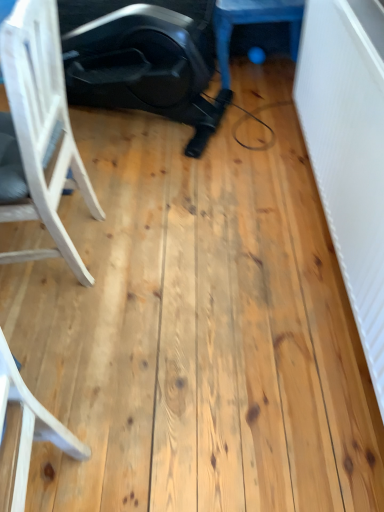
Question: Would you say blue rubber ball at upper center is inside or outside white wood chair at left?

Choices:
 (A) inside
 (B) outside

Answer: (B)

Question: Looking at the image, does blue rubber ball at upper center seem bigger or smaller compared to white wood chair at left?

Choices:
 (A) big
 (B) small

Answer: (B)

Question: Based on their positions, is blue rubber ball at upper center located to the left or right of white wood chair at left?

Choices:
 (A) left
 (B) right

Answer: (B)

Question: Is white wood chair at left in front of or behind blue rubber ball at upper center in the image?

Choices:
 (A) behind
 (B) front

Answer: (B)

Question: From the image's perspective, is white wood chair at left positioned above or below blue rubber ball at upper center?

Choices:
 (A) below
 (B) above

Answer: (A)

Question: In the image, is white wood chair at left on the left side or the right side of blue rubber ball at upper center?

Choices:
 (A) left
 (B) right

Answer: (A)

Question: From their relative heights in the image, would you say white wood chair at left is taller or shorter than blue rubber ball at upper center?

Choices:
 (A) short
 (B) tall

Answer: (B)